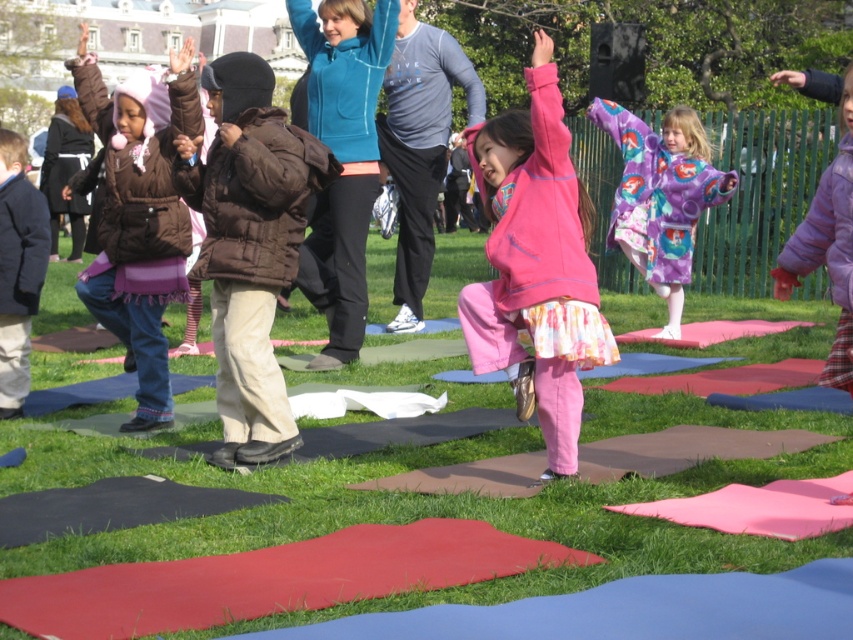
Question: Which of the following is the farthest from the observer?

Choices:
 (A) (554, 412)
 (B) (233, 278)

Answer: (B)

Question: Estimate the real-world distances between objects in this image. Which object is farther from the purple fleece jacket at upper right?

Choices:
 (A) pink matte/satin dress at center
 (B) matte brown jacket at center
 (C) brown puffy jacket at center
 (D) green grass at center

Answer: (D)

Question: Does green grass at center appear on the left side of purple fleece jacket at upper right?

Choices:
 (A) no
 (B) yes

Answer: (B)

Question: Is matte brown jacket at center above purple fleece jacket at upper right?

Choices:
 (A) no
 (B) yes

Answer: (B)

Question: Estimate the real-world distances between objects in this image. Which object is farther from the brown fuzzy coat at left?

Choices:
 (A) green grass at center
 (B) brown puffy jacket at center
 (C) pink matte/satin dress at center

Answer: (C)

Question: Observing the image, what is the correct spatial positioning of pink matte/satin dress at center in reference to purple fleece jacket at upper right?

Choices:
 (A) right
 (B) left

Answer: (B)